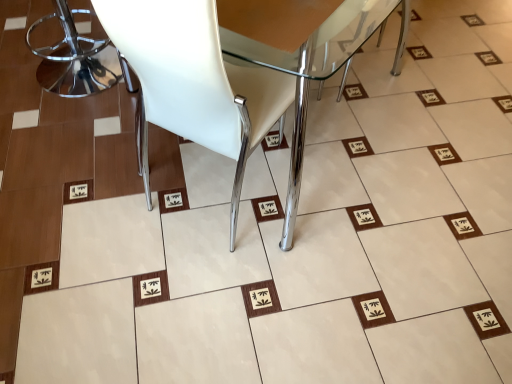
Question: From the image's perspective, would you say white matte chair at center, which is the second chair in left-to-right order, is positioned over polished chrome bar stool at left, the 2th chair positioned from the right?

Choices:
 (A) no
 (B) yes

Answer: (A)

Question: Is polished chrome bar stool at left, the 2th chair positioned from the right, surrounded by white matte chair at center, which appears as the first chair when viewed from the right?

Choices:
 (A) no
 (B) yes

Answer: (A)

Question: From a real-world perspective, is white matte chair at center, which is the second chair in left-to-right order, located beneath polished chrome bar stool at left, the 2th chair positioned from the right?

Choices:
 (A) no
 (B) yes

Answer: (A)

Question: From a real-world perspective, does white matte chair at center, which is the second chair in left-to-right order, stand above polished chrome bar stool at left, marked as the first chair in a left-to-right arrangement?

Choices:
 (A) no
 (B) yes

Answer: (B)

Question: From the image's perspective, is white matte chair at center, which is the second chair in left-to-right order, below polished chrome bar stool at left, marked as the first chair in a left-to-right arrangement?

Choices:
 (A) no
 (B) yes

Answer: (B)

Question: Does white matte chair at center, which appears as the first chair when viewed from the right, have a larger size compared to polished chrome bar stool at left, the 2th chair positioned from the right?

Choices:
 (A) yes
 (B) no

Answer: (A)

Question: Can you confirm if polished chrome bar stool at left, marked as the first chair in a left-to-right arrangement, is taller than white matte chair at center, which is the second chair in left-to-right order?

Choices:
 (A) no
 (B) yes

Answer: (A)

Question: Is polished chrome bar stool at left, the 2th chair positioned from the right, completely or partially outside of white matte chair at center, which appears as the first chair when viewed from the right?

Choices:
 (A) yes
 (B) no

Answer: (A)

Question: Is polished chrome bar stool at left, marked as the first chair in a left-to-right arrangement, aimed at white matte chair at center, which appears as the first chair when viewed from the right?

Choices:
 (A) no
 (B) yes

Answer: (B)

Question: Is polished chrome bar stool at left, the 2th chair positioned from the right, positioned behind white matte chair at center, which appears as the first chair when viewed from the right?

Choices:
 (A) yes
 (B) no

Answer: (A)

Question: Is the surface of polished chrome bar stool at left, marked as the first chair in a left-to-right arrangement, in direct contact with white matte chair at center, which appears as the first chair when viewed from the right?

Choices:
 (A) no
 (B) yes

Answer: (A)

Question: Is polished chrome bar stool at left, marked as the first chair in a left-to-right arrangement, looking in the opposite direction of white matte chair at center, which is the second chair in left-to-right order?

Choices:
 (A) yes
 (B) no

Answer: (B)

Question: In terms of size, does white matte chair at center, which appears as the first chair when viewed from the right, appear bigger or smaller than polished chrome bar stool at left, the 2th chair positioned from the right?

Choices:
 (A) small
 (B) big

Answer: (B)